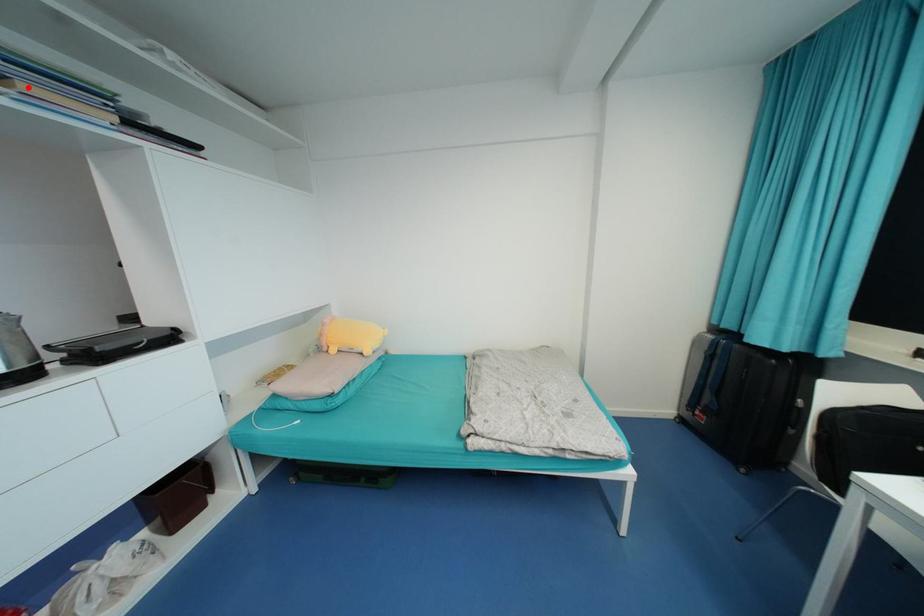
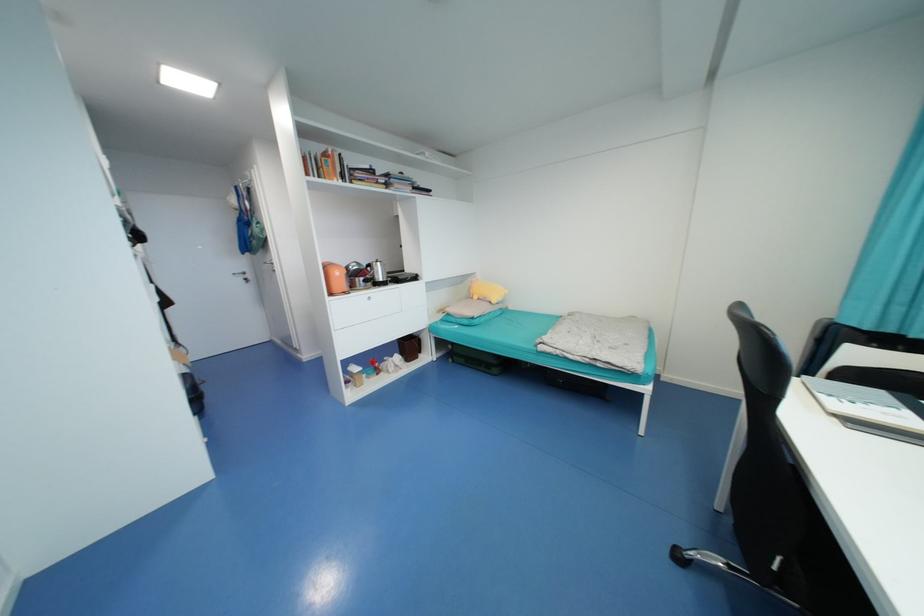
Question: I am providing you with two images of the same scene from different viewpoints. A red point is shown in image1. For the corresponding object point in image2, is it positioned nearer or farther from the camera?

Choices:
 (A) Nearer
 (B) Farther

Answer: (A)